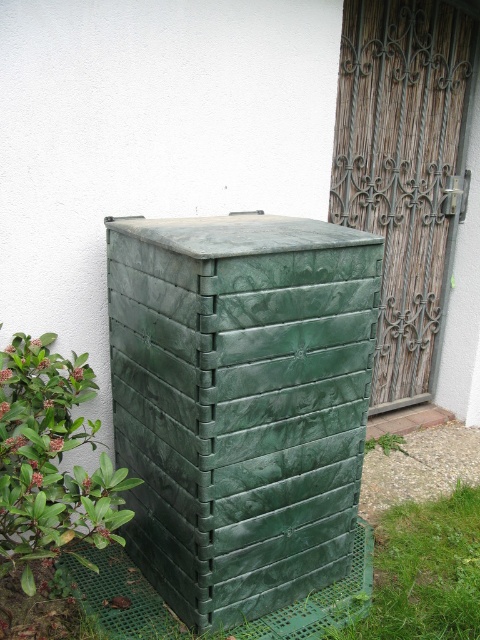
You are a gardener holding a bag of soil that is 24 inches wide. You need to place the bag between the green plastic crate at center and the green grass at lower right. Is there enough space for the bag?

The distance between the green plastic crate at center and the green grass at lower right is 26.38 inches. Since the bag is 24 inches wide, there is enough space to place it between them.

You are a delivery person trying to determine if you can fit a package through the space between the wooden textured door at right and the green grass at lower right. The package is 1.2 meters tall. Can the package pass through?

The wooden textured door at right is taller than the green grass at lower right. Since the package is 1.2 meters tall, it can pass through as long as the door is at least 1.2 meters tall. However, since the grass is shorter than the door, the limiting factor is the door height. Without knowing the exact height of the door, we cannot confirm if the package will fit.